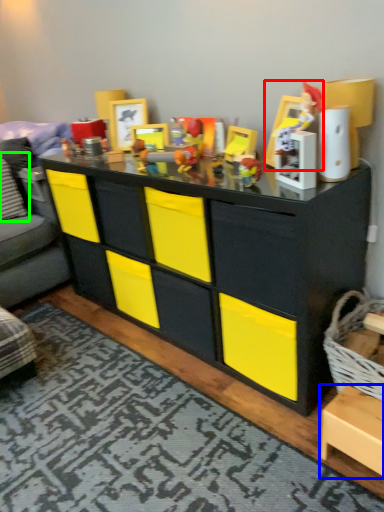
Question: Which object is positioned closest to toy (highlighted by a red box)? Select from cabinetry (highlighted by a blue box) and pillow (highlighted by a green box).

Choices:
 (A) cabinetry
 (B) pillow

Answer: (A)